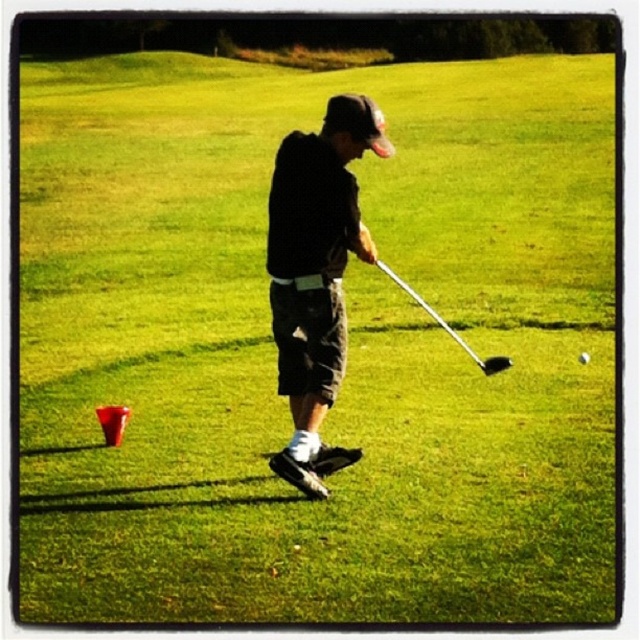
You are a golf instructor observing a student practicing their swing. The student is using two golf clubs, the black matte golf club at center and the glossy black golf club at center. Which club should the student use for a standard practice session, and why?

The student should use the black matte golf club at center because it has a larger size compared to the glossy black golf club at center, making it more suitable for a standard practice session.

You are a golfer standing in the middle of a grassy field. You see a point marked at coordinates (316, 275). What object is located at that point?

The point at coordinates (316, 275) marks the location of the black matte golf club at center.